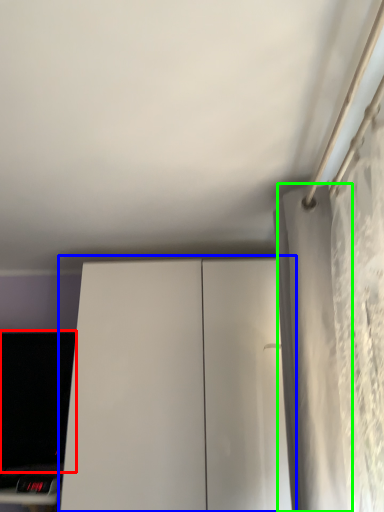
Question: Based on their relative distances, which object is farther from computer monitor (highlighted by a red box)? Choose from dresser (highlighted by a blue box) and curtain (highlighted by a green box).

Choices:
 (A) dresser
 (B) curtain

Answer: (B)